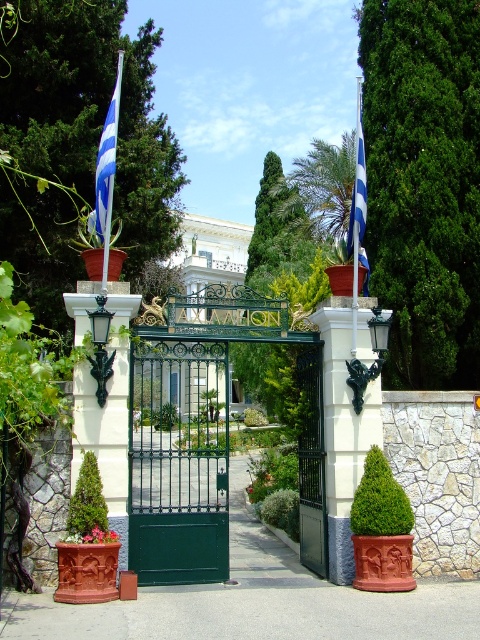
Question: Which point is farther to the camera?

Choices:
 (A) blue and white striped flag at center
 (B) blue striped flag at upper left
 (C) green textured bush at center
 (D) green textured topiary at center

Answer: (A)

Question: Estimate the real-world distances between objects in this image. Which object is closer to the blue and white striped flag at center?

Choices:
 (A) green textured bush at center
 (B) green metal gate at center
 (C) green matte gate at center

Answer: (B)

Question: Does green leafy tree at upper center have a lesser width compared to green textured bush at center?

Choices:
 (A) yes
 (B) no

Answer: (B)

Question: Is green leafy tree at upper center bigger than green metal gate at center?

Choices:
 (A) yes
 (B) no

Answer: (A)

Question: Does green leafy tree at upper center appear over green matte gate at center?

Choices:
 (A) yes
 (B) no

Answer: (A)

Question: Which object is positioned farthest from the green leafy tree at upper center?

Choices:
 (A) green matte gate at center
 (B) green textured bush at center
 (C) green textured topiary at center

Answer: (A)